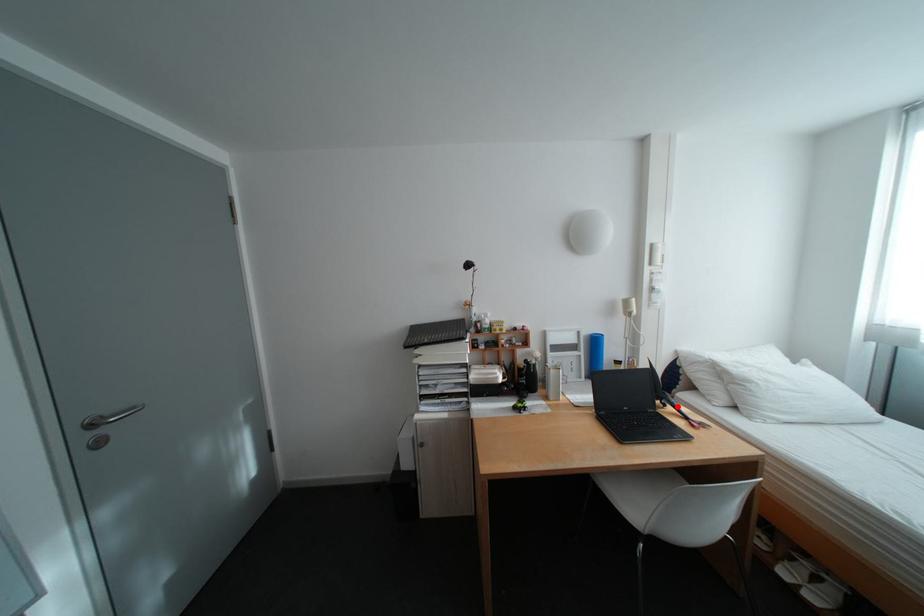
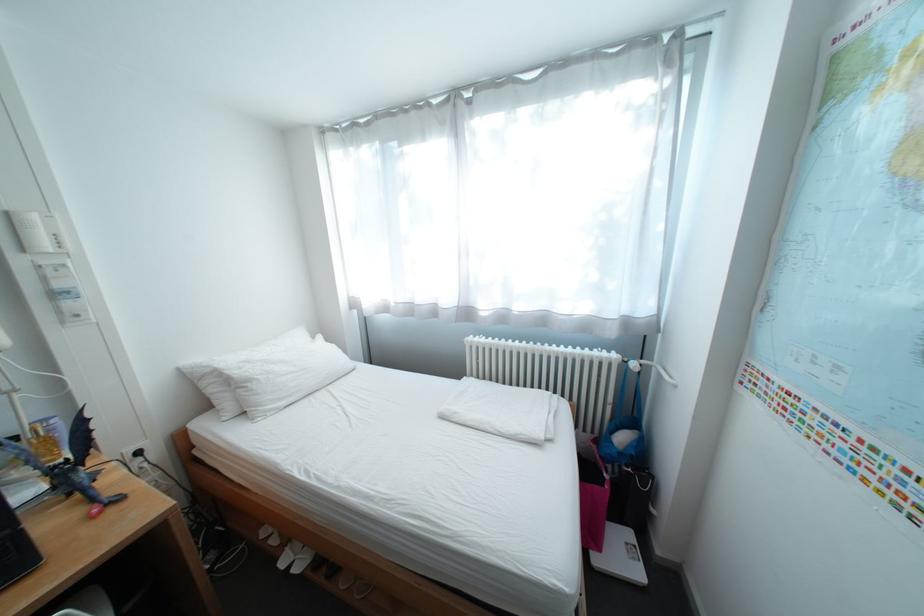
Locate, in the second image, the point that corresponds to the highlighted location in the first image.

(81, 495)